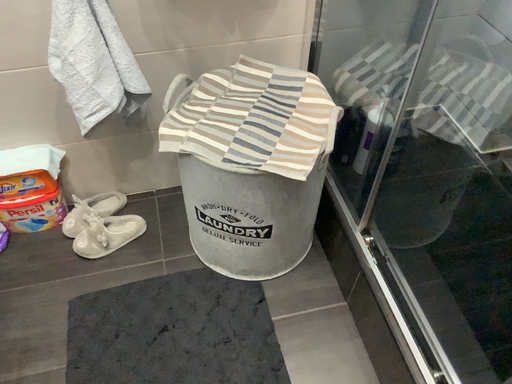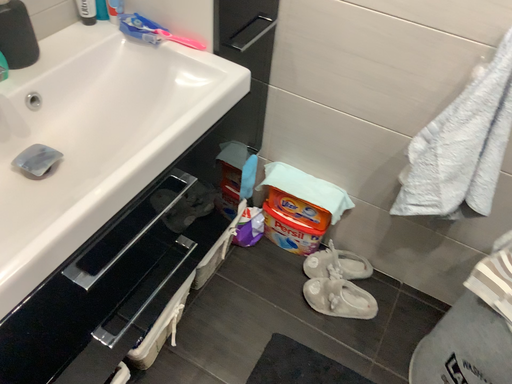
Question: How did the camera likely rotate when shooting the video?

Choices:
 (A) rotated upward
 (B) rotated downward

Answer: (A)